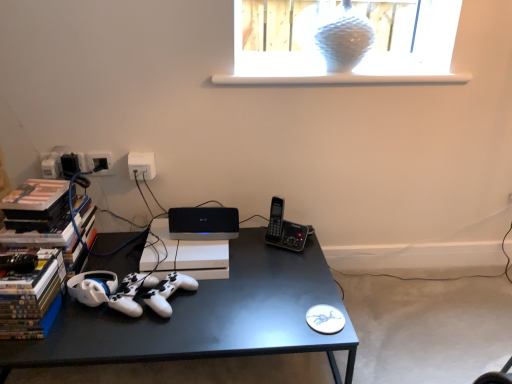
Identify the location of free location in front of white matte game controller at center. (154, 333).